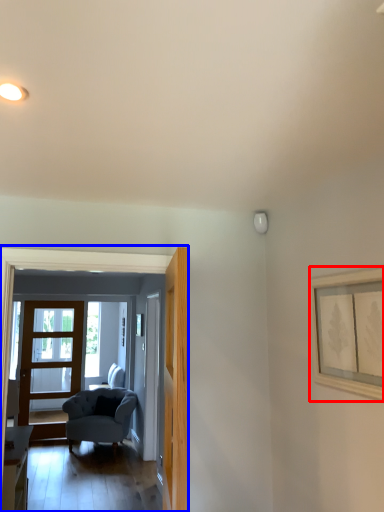
Question: Which object appears closest to the camera in this image, picture frame (highlighted by a red box) or residence (highlighted by a blue box)?

Choices:
 (A) picture frame
 (B) residence

Answer: (A)